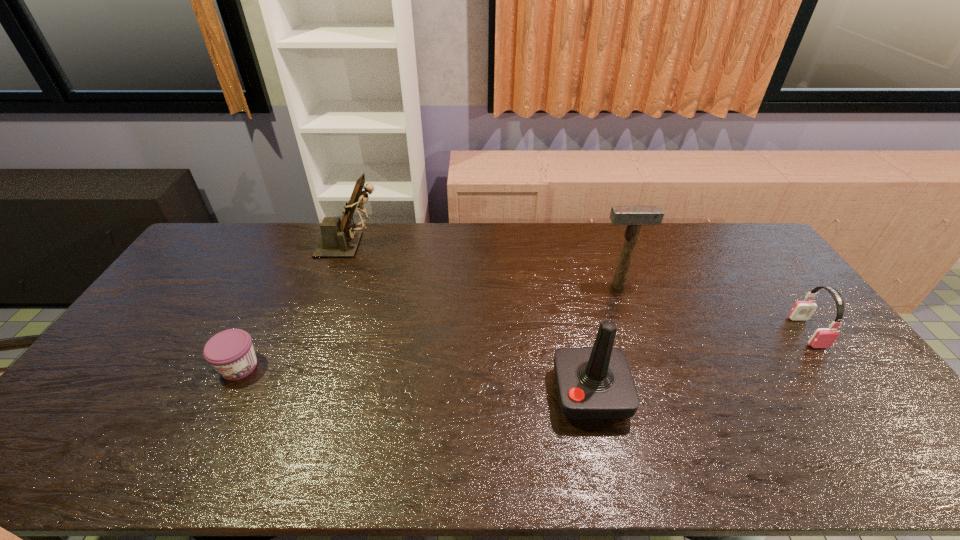
This screenshot has width=960, height=540. What are the coordinates of `free space located on the front of the fourth nearest object` in the screenshot? It's located at (647, 369).

Identify the location of free region located on the back of the joystick. (564, 278).

Identify the location of free space located on the outer surface of the third farthest object. This screenshot has width=960, height=540. (894, 449).

Image resolution: width=960 pixels, height=540 pixels. I want to click on free region located 0.120m on the front label of the leftmost object, so click(x=209, y=426).

Identify the location of object at the far edge. (339, 239).

Find the location of a particular element. object positioned at the right edge is located at coordinates (802, 310).

This screenshot has width=960, height=540. In the image, there is a desktop. Identify the location of free space at the far edge. (374, 248).

Where is `vacant point at the near edge`? Image resolution: width=960 pixels, height=540 pixels. vacant point at the near edge is located at coordinates (442, 444).

Where is `vacant area at the right edge of the desktop`? The width and height of the screenshot is (960, 540). vacant area at the right edge of the desktop is located at coordinates (785, 312).

Locate an element on the screen. vacant space at the far left corner is located at coordinates (211, 238).